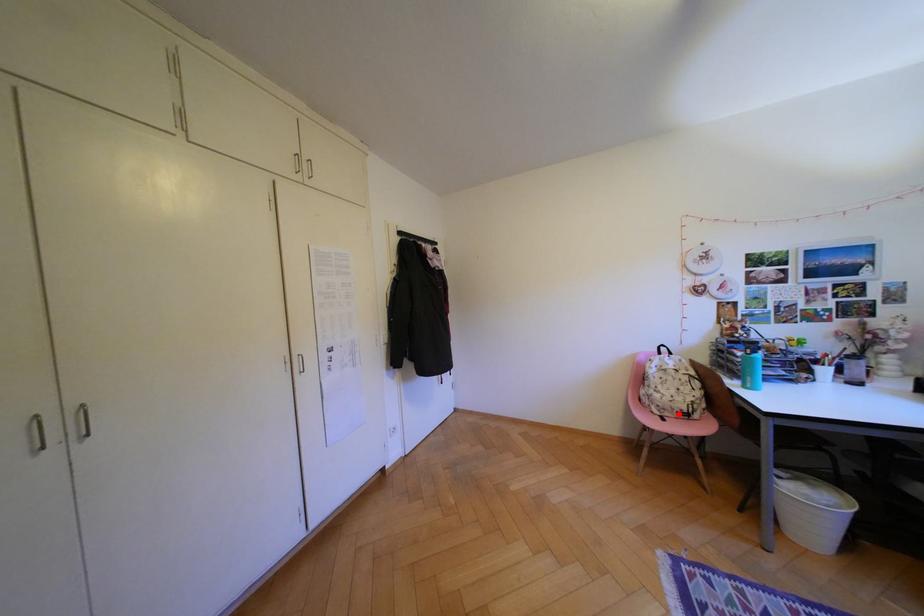
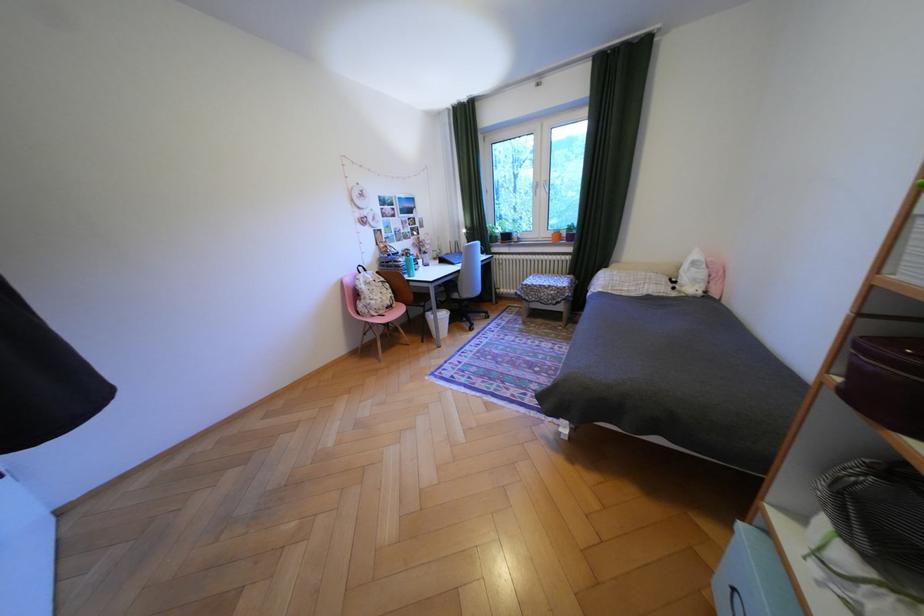
Question: I am providing you with two images of the same scene from different viewpoints. In image1, a red point is highlighted. Considering the same 3D point in image2, which of the following is correct?

Choices:
 (A) It is closer
 (B) It is farther

Answer: (A)